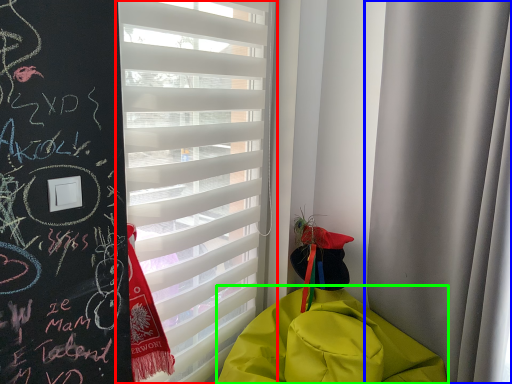
Question: Considering the real-world distances, which object is closest to window blind (highlighted by a red box)? curtain (highlighted by a blue box) or blanket (highlighted by a green box).

Choices:
 (A) curtain
 (B) blanket

Answer: (B)